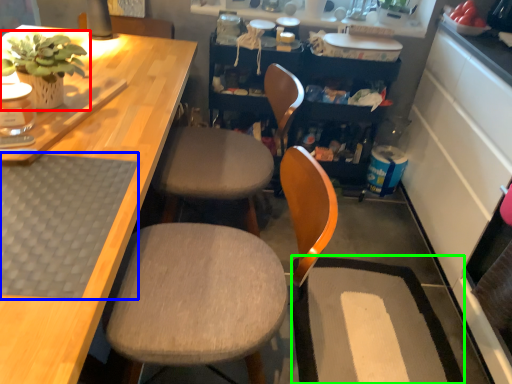
Question: Which object is positioned closest to houseplant (highlighted by a red box)? Select from mat (highlighted by a blue box) and wide (highlighted by a green box).

Choices:
 (A) mat
 (B) wide

Answer: (A)